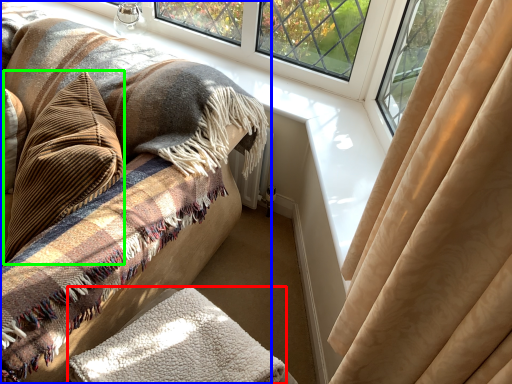
Question: Estimate the real-world distances between objects in this image. Which object is farther from blanket (highlighted by a red box), furniture (highlighted by a blue box) or throw pillow (highlighted by a green box)?

Choices:
 (A) furniture
 (B) throw pillow

Answer: (B)